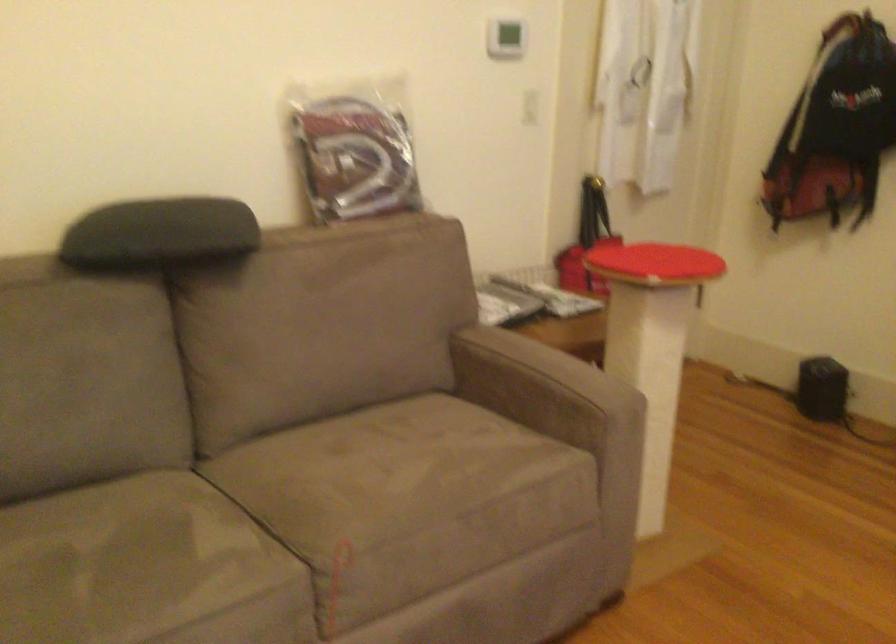
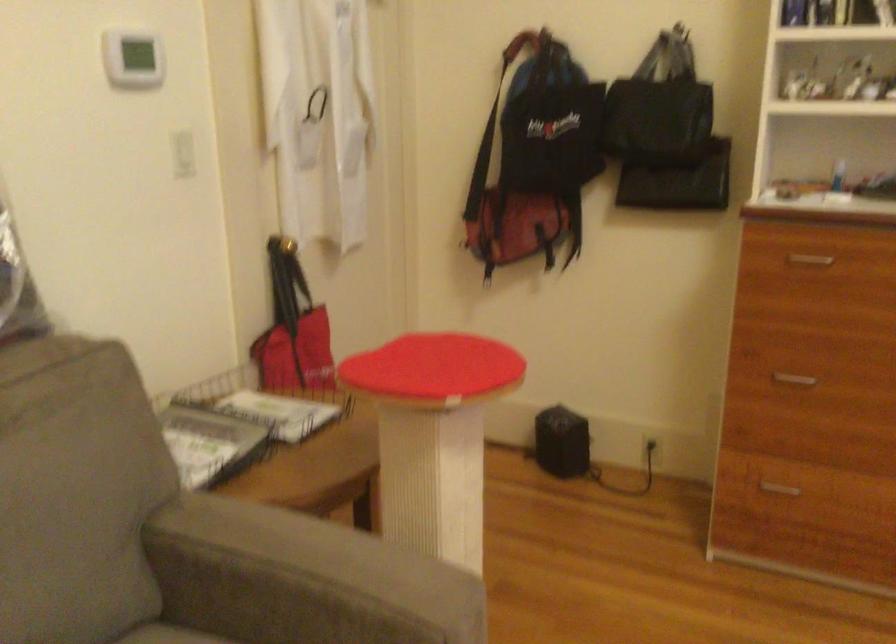
Locate, in the second image, the point that corresponds to point 554,292 in the first image.

(265, 402)